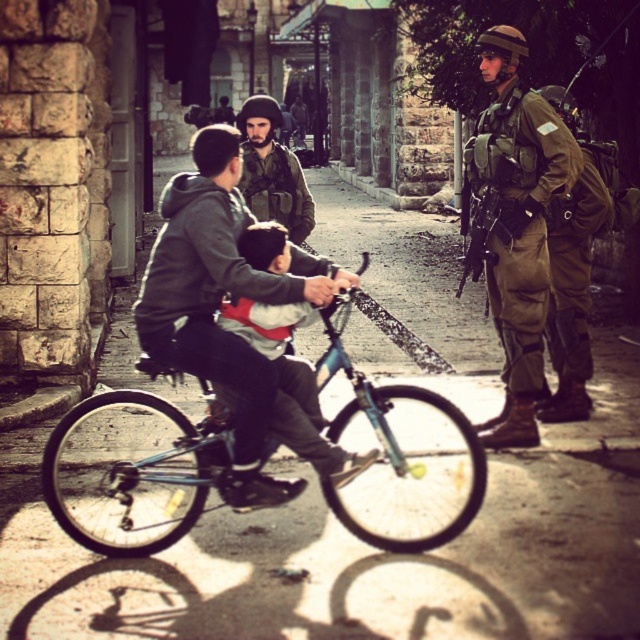
Question: From the image, what is the correct spatial relationship of light blue plastic bicycle at center in relation to camouflage uniform at right?

Choices:
 (A) above
 (B) below

Answer: (B)

Question: In this image, where is camouflage uniform at right located relative to camouflage uniform at center?

Choices:
 (A) right
 (B) left

Answer: (A)

Question: Which object is closer to the camera taking this photo?

Choices:
 (A) teal matte bicycle at center
 (B) matte black rifle at center
 (C) camouflage uniform at right

Answer: (A)

Question: Can you confirm if matte blue bicycle at center is positioned above matte black rifle at center?

Choices:
 (A) yes
 (B) no

Answer: (B)

Question: Which object is farther from the camera taking this photo?

Choices:
 (A) matte blue bicycle at center
 (B) light blue plastic bicycle at center
 (C) teal matte bicycle at center
 (D) camouflage uniform at right

Answer: (D)

Question: Which object is farther from the camera taking this photo?

Choices:
 (A) light blue plastic bicycle at center
 (B) camouflage uniform at right
 (C) teal matte bicycle at center
 (D) matte blue bicycle at center

Answer: (B)